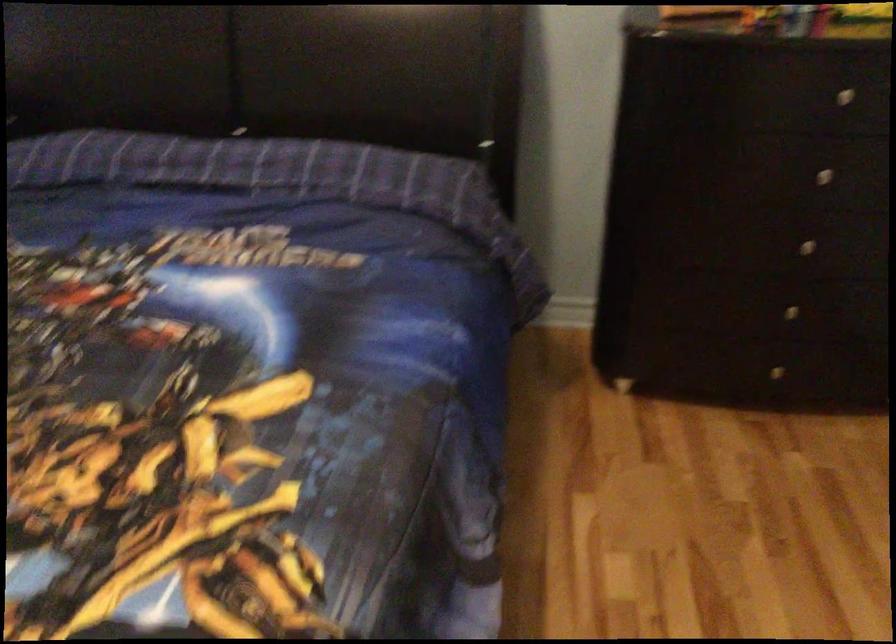
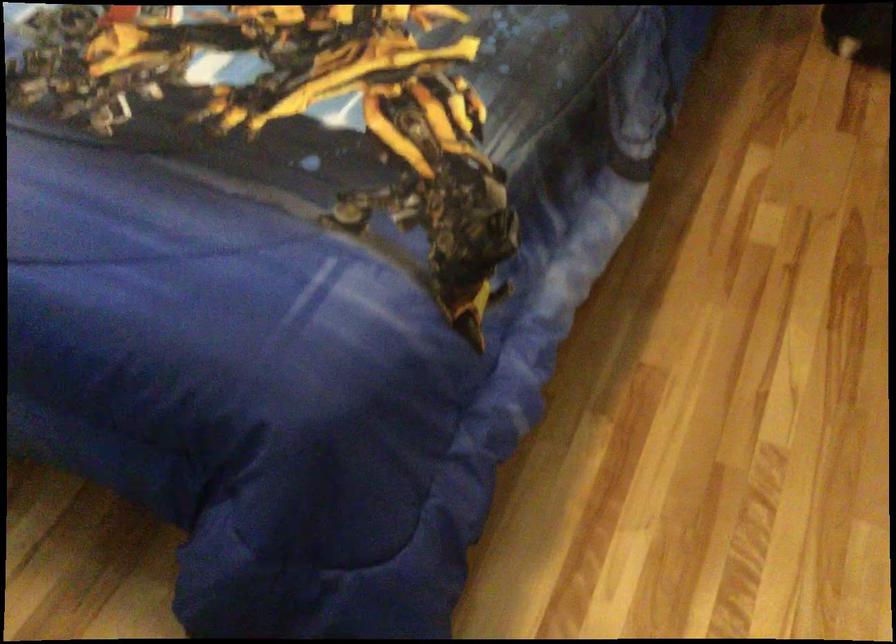
Which direction would the cameraman need to move to produce the second image?

The cameraman moved toward right, backward.